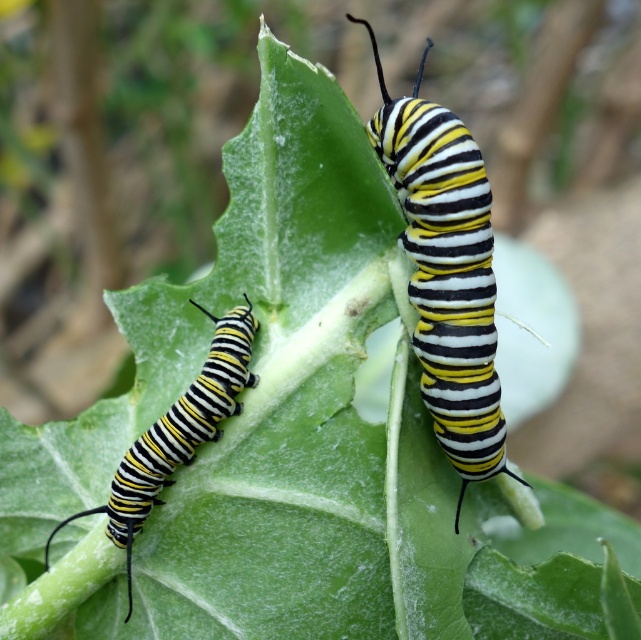
You are a biologist observing two points on a leaf where monarch caterpillars are feeding. The points are labeled as point 1 at coordinates (444, 113) and point 2 at (140, 499). Based on the image, which point is closer to you?

Point 1 at coordinates (444, 113) is closer to the viewer than point 2 at (140, 499).